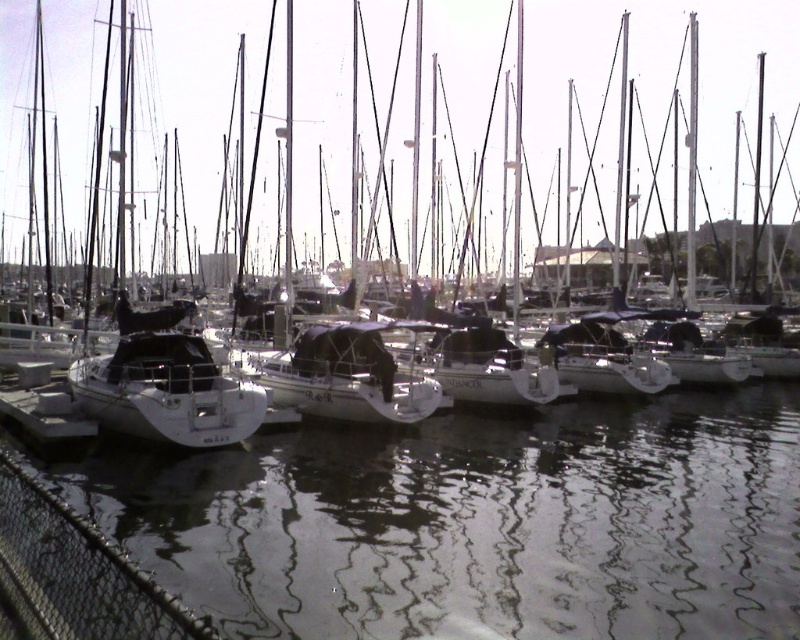
Based on the photo, you are planning to take a photo of the clear water at center and the white matte sailboat at left from the dock. Which object will appear smaller in your photo?

The clear water at center will appear smaller in the photo because it occupies less space than the white matte sailboat at left.

You are standing at the edge of the marina and want to locate the clear water at center. Based on the coordinates provided, where would you look relative to your position?

The clear water at center is located at the coordinates point (476, 522), which is towards the lower center area of the marina.